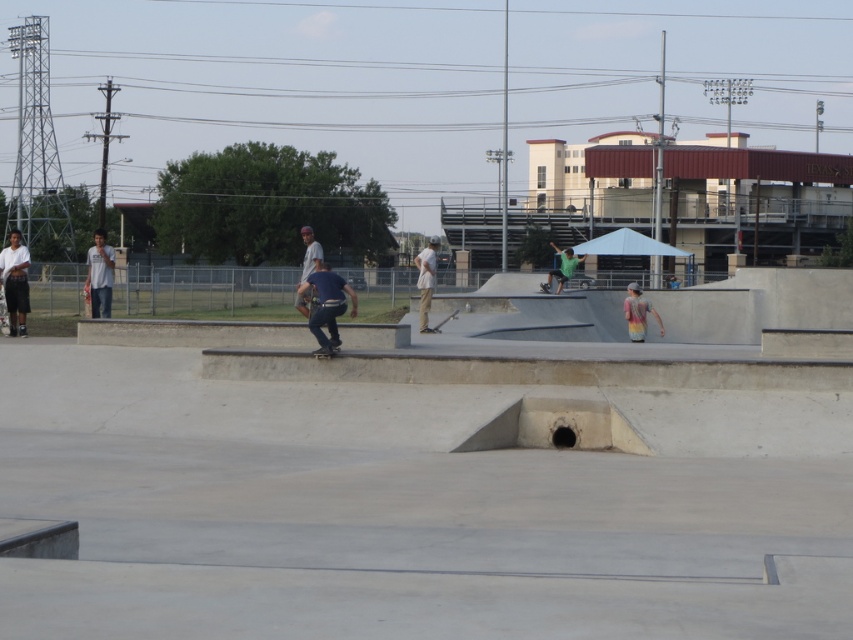
You are a photographer positioned at the edge of the skatepark. You want to capture both the dark blue jeans at center and the light brown canvas pants at center in a single photo. Which person will appear closer to the camera in the photo?

The dark blue jeans at center will appear closer to the camera in the photo because it is in front of the light brown canvas pants at center.

You are a photographer standing at the point marked by the coordinates point (15, 282), which is the white cotton shirt at left. You want to take a photo of the skatepark. Which direction should you face to capture the entire skatepark area in your shot?

The photographer should face away from the white cotton shirt at left to capture the entire skatepark area, as the shirt is positioned at the edge of the scene.